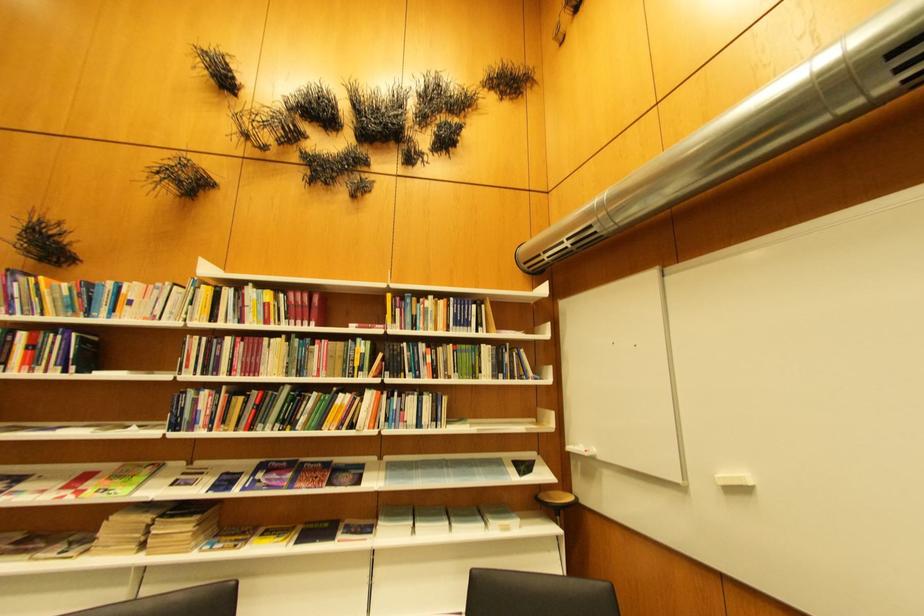
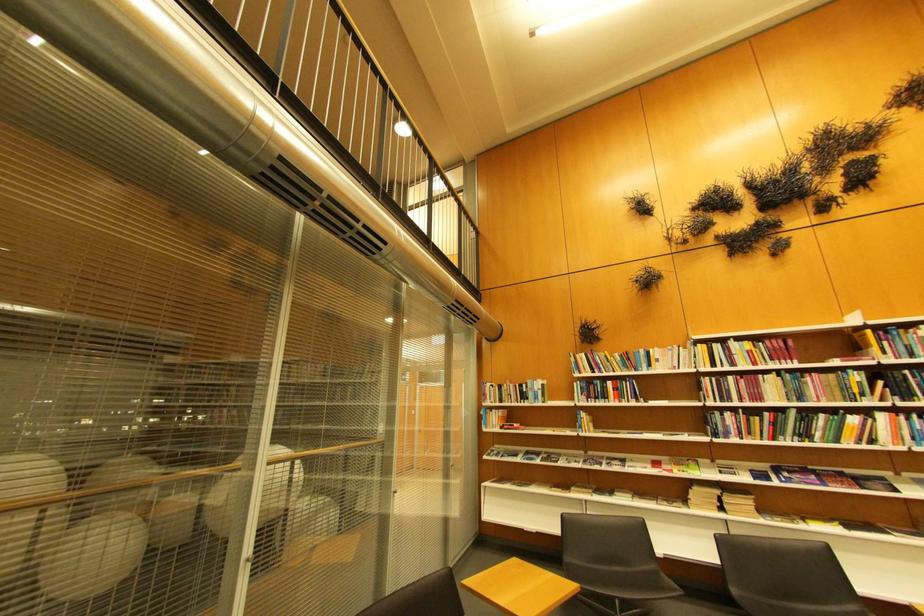
The point at (399, 297) is marked in the first image. Where is the corresponding point in the second image?

(880, 333)